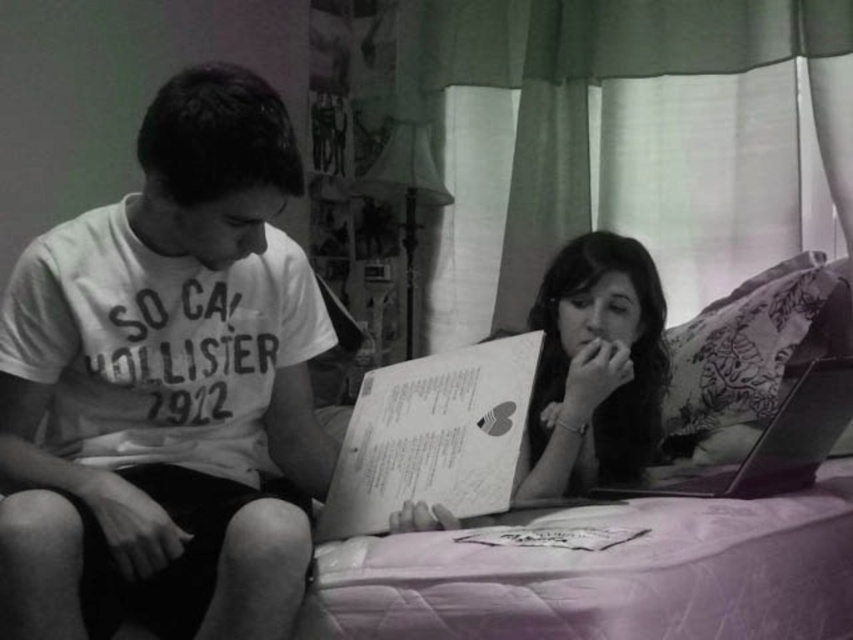
Is paperback book at center further to the viewer compared to pink quilted bed at center?

No, it is in front of pink quilted bed at center.

I want to click on paperback book at center, so click(433, 436).

Who is higher up, smooth paper book at center or metallic silver laptop at lower right?

smooth paper book at center

This screenshot has width=853, height=640. I want to click on smooth paper book at center, so click(x=595, y=368).

Locate an element on the screen. This screenshot has height=640, width=853. smooth paper book at center is located at coordinates (595, 368).

Which is behind, point (245, 570) or point (643, 483)?

Positioned behind is point (643, 483).

What do you see at coordinates (167, 388) in the screenshot? I see `white cotton t-shirt at left` at bounding box center [167, 388].

Find the location of a particular element. white cotton t-shirt at left is located at coordinates tap(167, 388).